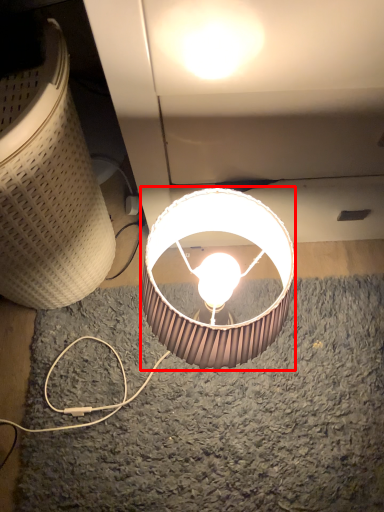
Question: From the image, what is the correct spatial relationship of lamp (annotated by the red box) in relation to lamp?

Choices:
 (A) right
 (B) left

Answer: (A)